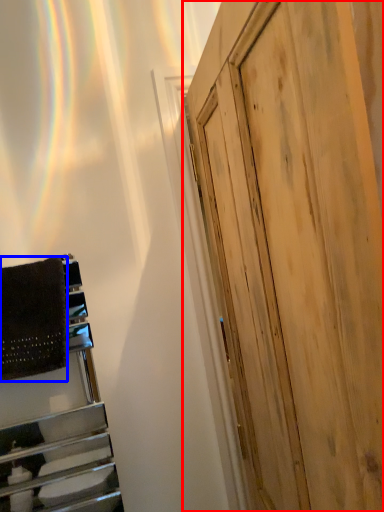
Question: Which point is closer to the camera, door (highlighted by a red box) or blanket (highlighted by a blue box)?

Choices:
 (A) door
 (B) blanket

Answer: (A)